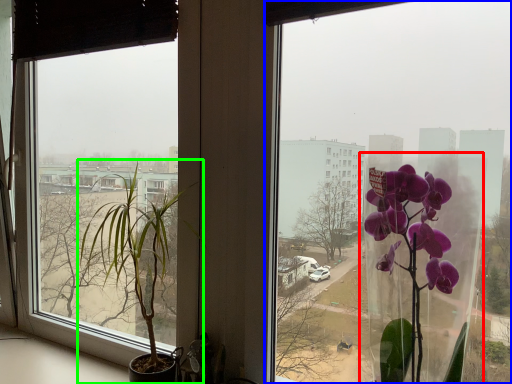
Question: Which is nearer to the glass vase (highlighted by a red box)? window (highlighted by a blue box) or houseplant (highlighted by a green box).

Choices:
 (A) window
 (B) houseplant

Answer: (B)